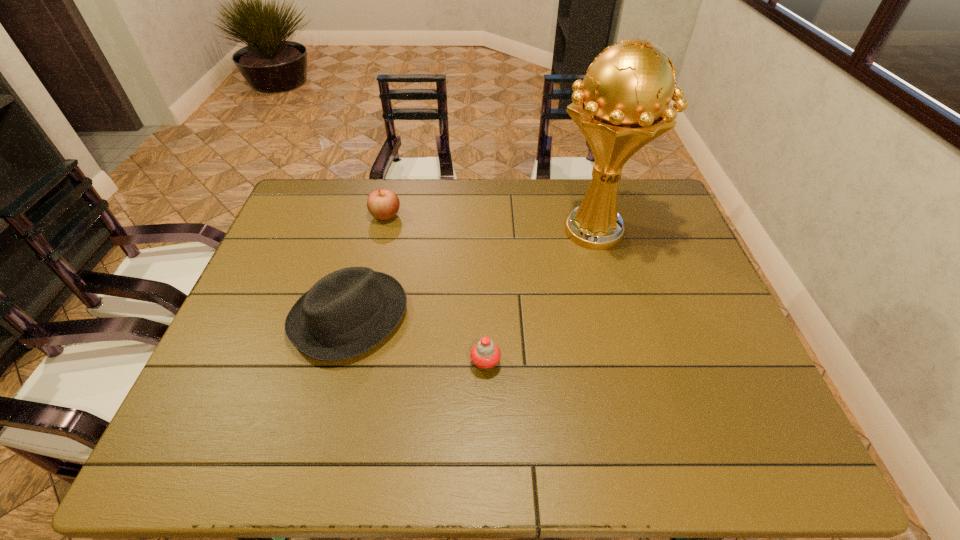
Locate an element on the screen. blank region between the apple and the rightmost object is located at coordinates (491, 224).

In order to click on vacant area that lies between the apple and the tallest object in this screenshot , I will do point(491,224).

Locate an element on the screen. The width and height of the screenshot is (960, 540). free space between the apple and the cupcake is located at coordinates (436, 289).

Image resolution: width=960 pixels, height=540 pixels. Identify the location of vacant region between the second object from right to left and the trophy_cup. (540, 298).

Identify the location of free space between the fedora and the third object from left to right. This screenshot has height=540, width=960. (418, 340).

Locate an element on the screen. Image resolution: width=960 pixels, height=540 pixels. free space that is in between the fedora and the apple is located at coordinates (368, 266).

The width and height of the screenshot is (960, 540). Find the location of `free space that is in between the fedora and the apple`. free space that is in between the fedora and the apple is located at coordinates (368, 266).

At what (x,y) coordinates should I click in order to perform the action: click on blank region between the third shortest object and the rightmost object. Please return your answer as a coordinate pair (x, y). This screenshot has width=960, height=540. Looking at the image, I should click on (472, 274).

Select which object is the third closest to the trophy_cup. Please provide its 2D coordinates. Your answer should be formatted as a tuple, i.e. [(x, y)], where the tuple contains the x and y coordinates of a point satisfying the conditions above.

[(383, 204)]

You are a GUI agent. You are given a task and a screenshot of the screen. Output one action in this format:
    pyautogui.click(x=<x>, y=<y>)
    Task: Click on the object that is the second nearest to the trophy_cup
    The height and width of the screenshot is (540, 960).
    Given the screenshot: What is the action you would take?
    pyautogui.click(x=347, y=312)